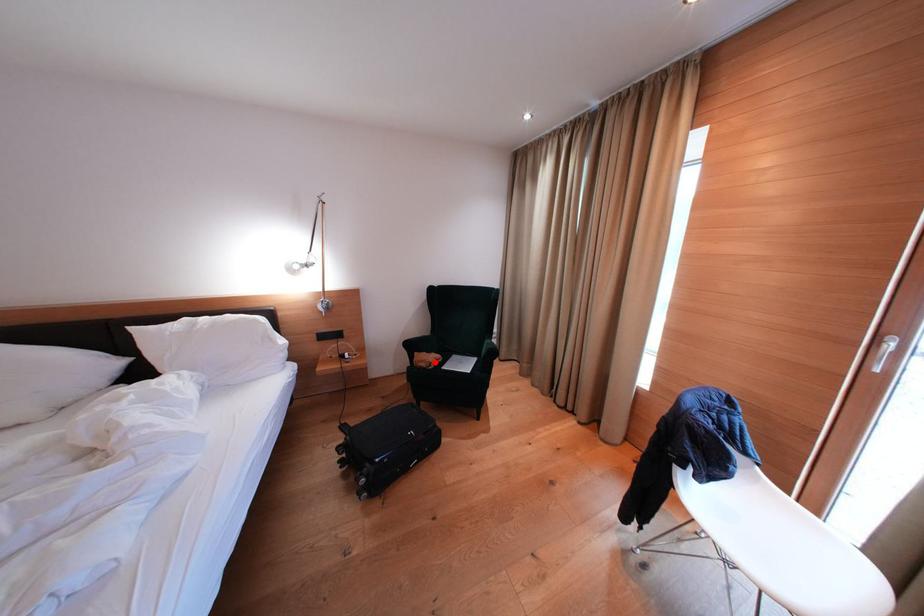
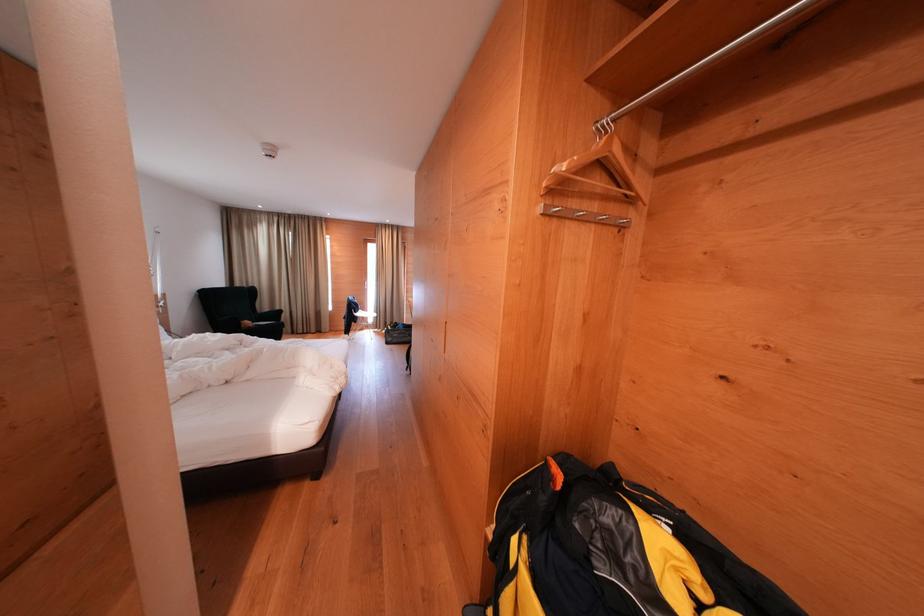
Locate, in the second image, the point that corresponds to the highlighted location in the first image.

(254, 328)